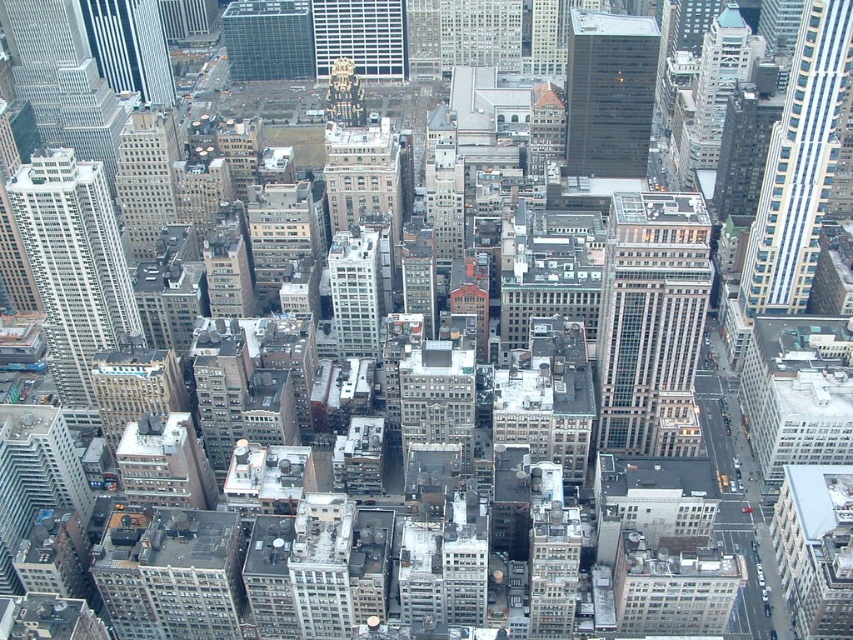
You are a drone operator tasked with capturing aerial footage of the city. Your current position is directly above the white smooth building at center. You need to fly to the glassy steel skyscraper at upper right. Which direction should you fly to reach it?

The glassy steel skyscraper at upper right is to the right of the white smooth building at center, so you should fly to the right to reach it.

You are a drone operator flying over the city and need to deliver a package to the white glass skyscraper at center. There is a dark glass skyscraper at center in your path. Can you safely navigate around it without getting too close?

The dark glass skyscraper at center is closer to the viewer than the white glass skyscraper at center, so you can safely navigate around it as long as you maintain a safe distance from the closer dark glass skyscraper at center.

You are a drone operator flying a drone that needs to navigate between the glassy steel skyscraper at upper right and the white smooth building at center. Based on the scene, which building should the drone fly under to avoid collision?

The drone should fly under the glassy steel skyscraper at upper right because it is positioned above the white smooth building at center, so flying under it would avoid collision.